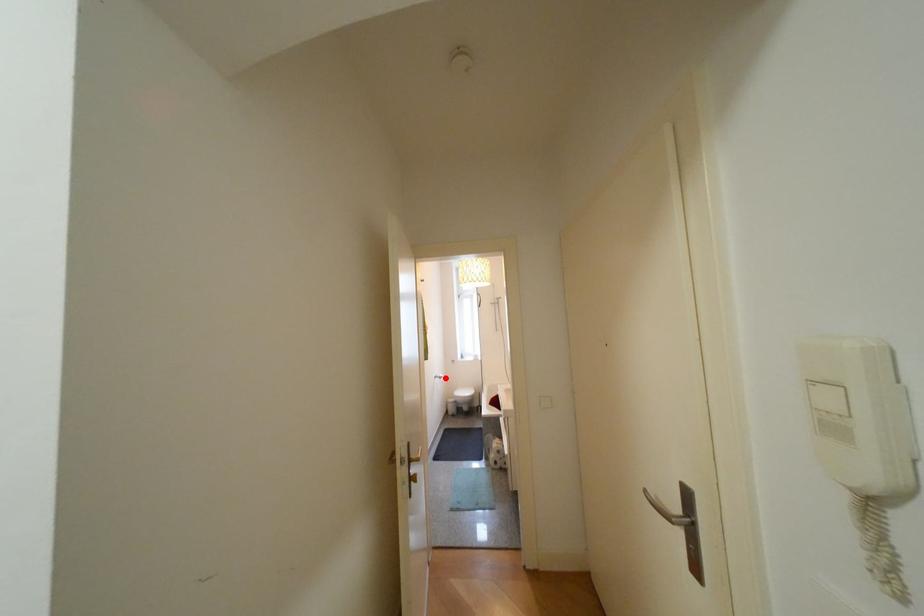
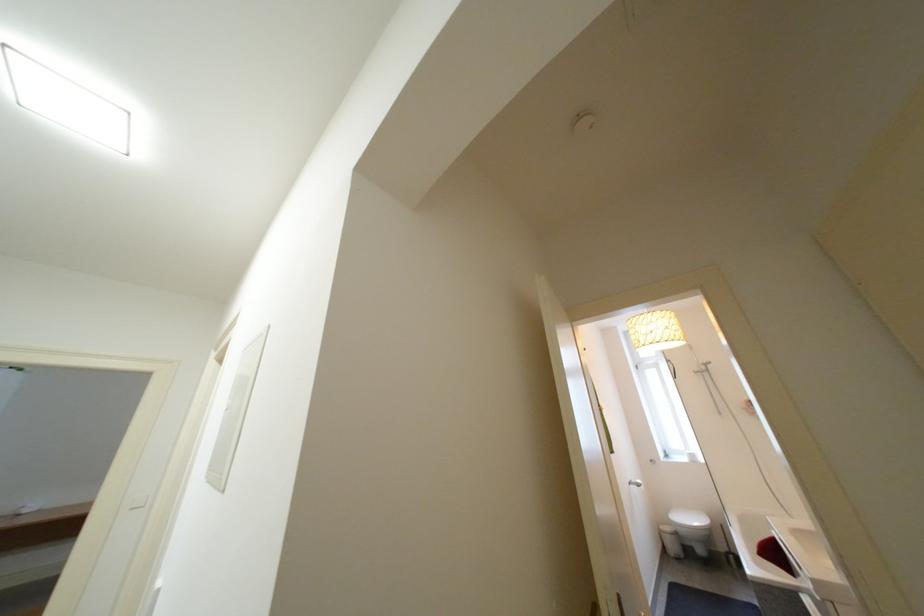
In the second image, find the point that corresponds to the highlighted location in the first image.

(639, 485)